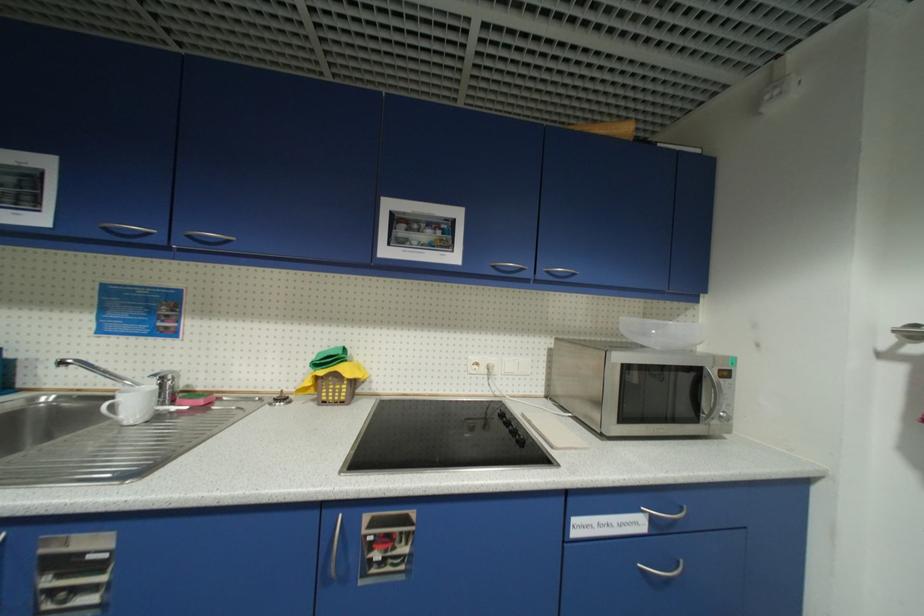
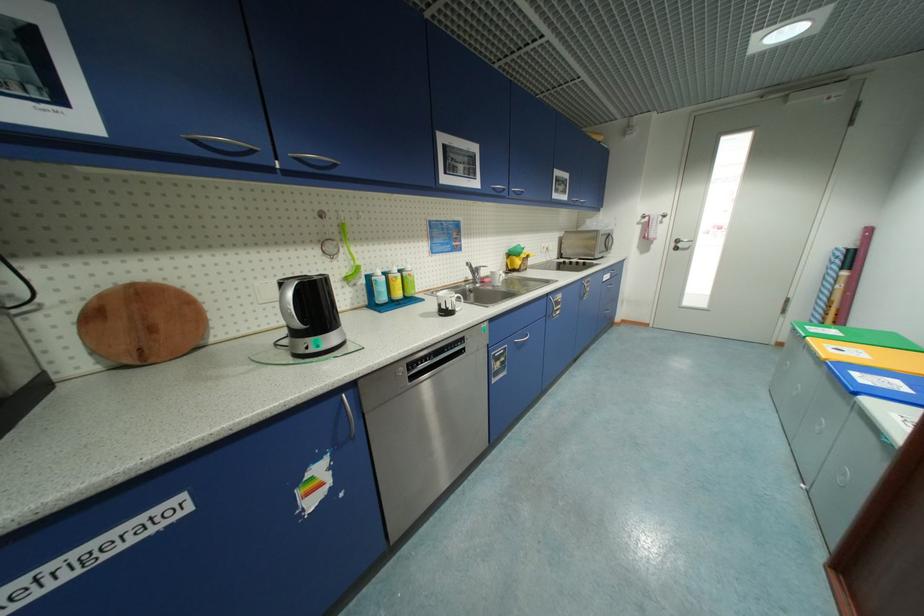
Find the pixel in the second image that matches (112,230) in the first image.

(499, 190)